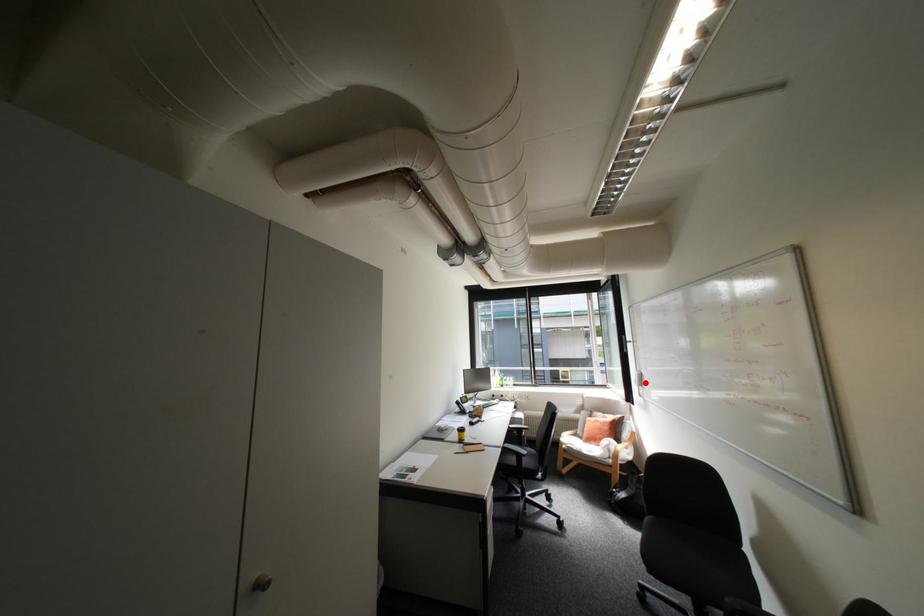
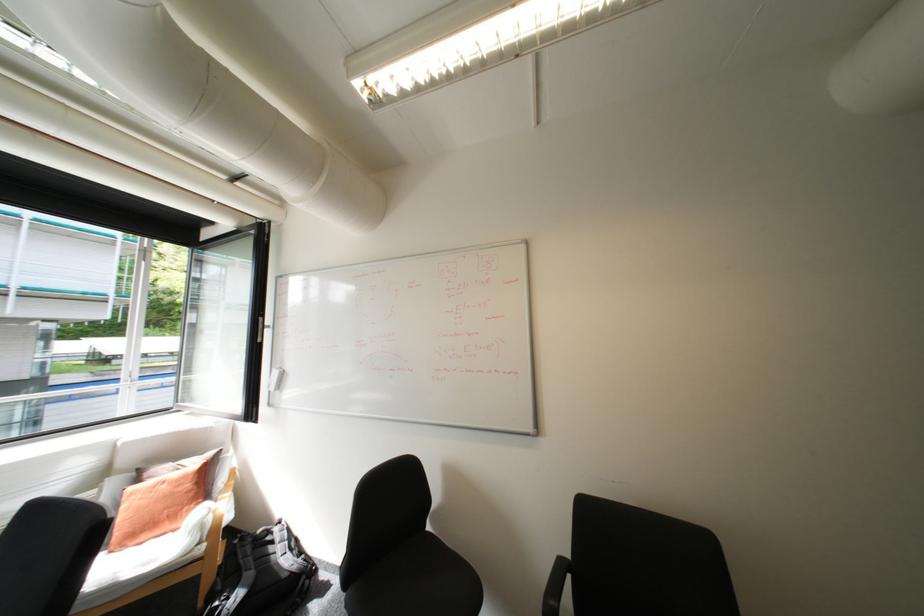
Find the pixel in the second image that matches the highlighted location in the first image.

(277, 387)